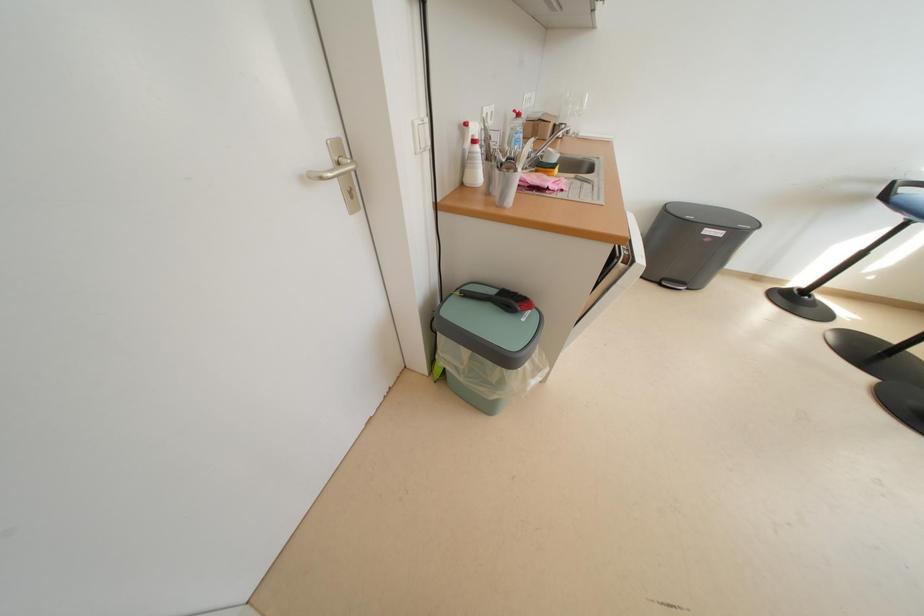
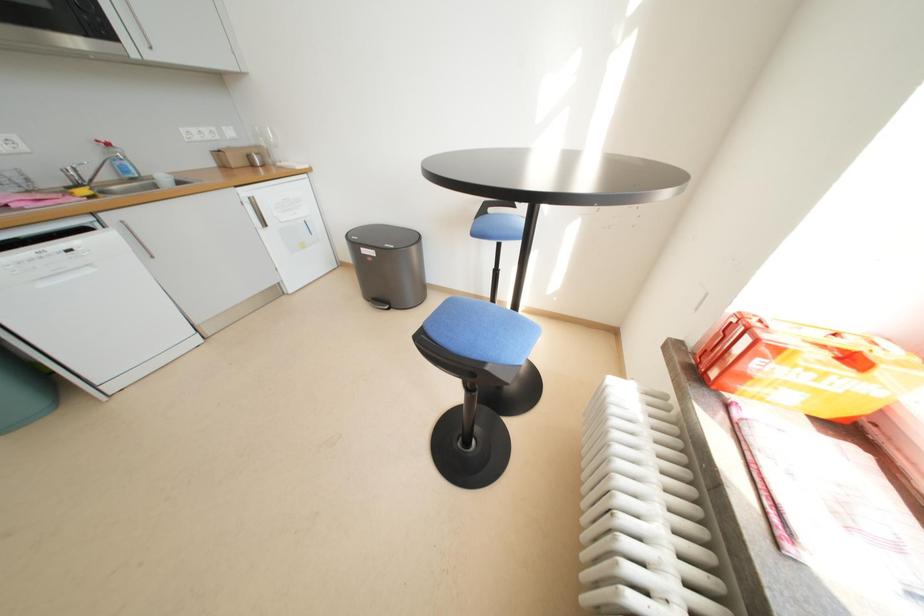
Question: The images are taken continuously from a first-person perspective. In which direction are you moving?

Choices:
 (A) Left
 (B) Right
 (C) Forward
 (D) Backward

Answer: (B)